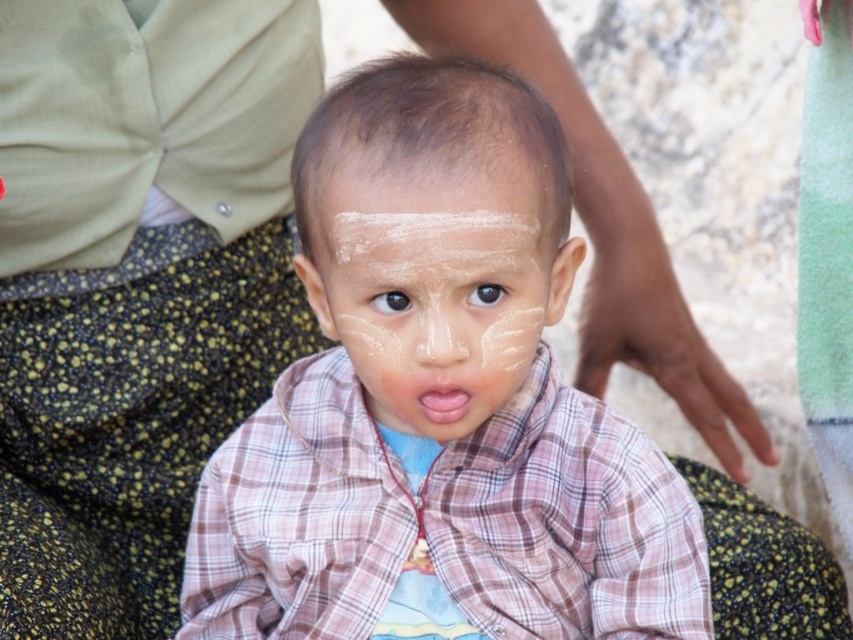
Is white matte paint at center wider than black matte eye at center?

Yes, white matte paint at center is wider than black matte eye at center.

Does point (517, 186) lie behind point (409, 300)?

No, (517, 186) is in front of (409, 300).

Where is `white matte paint at center`? white matte paint at center is located at coordinates (430, 212).

Who is lower down, smooth plaid shirt at center or black matte eye at center?

smooth plaid shirt at center is lower down.

Measure the distance between smooth plaid shirt at center and camera.

smooth plaid shirt at center and camera are 88.87 centimeters apart from each other.

Image resolution: width=853 pixels, height=640 pixels. Identify the location of smooth plaid shirt at center. (438, 403).

Is brown matte eye at center in front of black matte eye at center?

Yes, brown matte eye at center is in front of black matte eye at center.

Who is lower down, brown matte eye at center or black matte eye at center?

black matte eye at center is lower down.

This screenshot has width=853, height=640. I want to click on brown matte eye at center, so click(x=486, y=296).